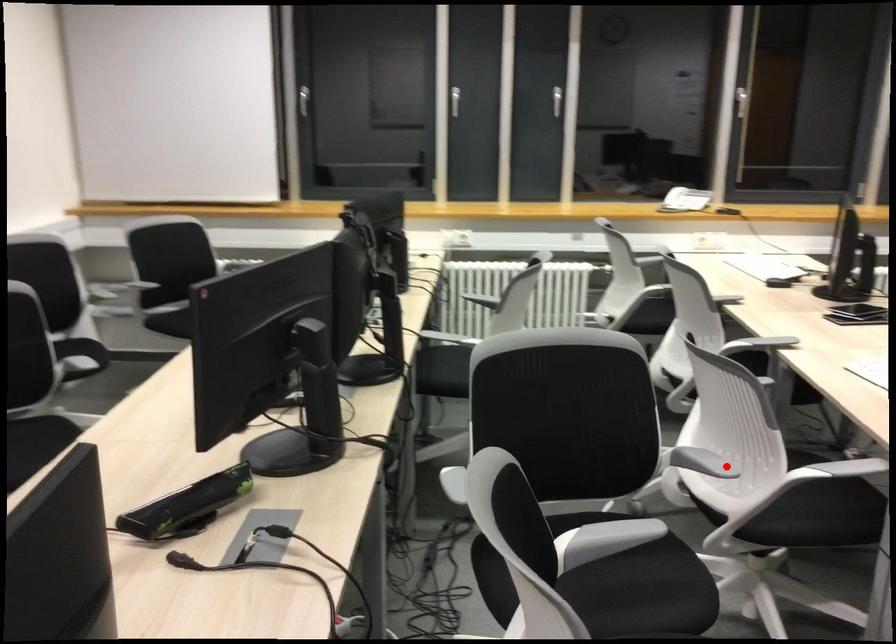
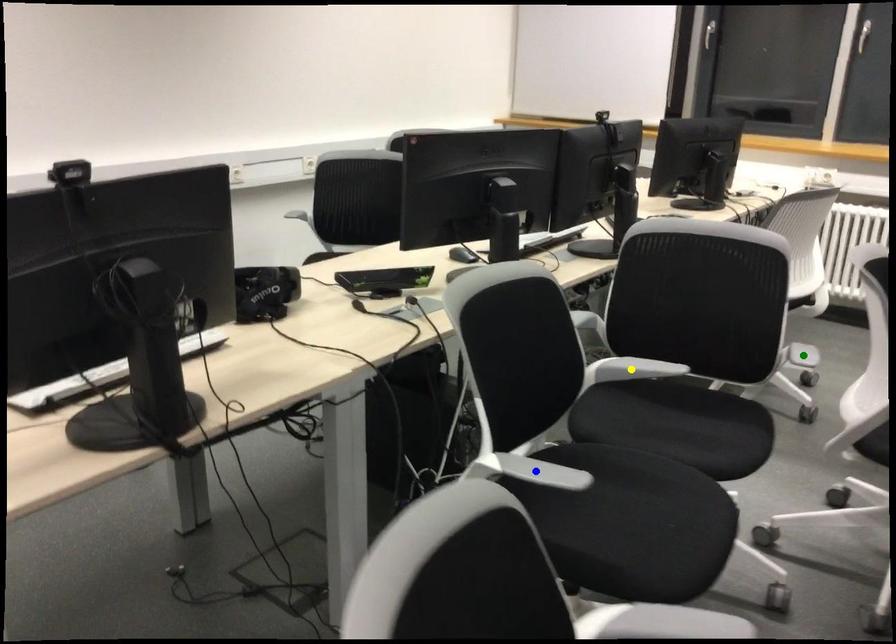
Question: I am providing you with two images of the same scene from different viewpoints. A red point is marked on the first image. You are given multiple points on the second image. Which point in image 2 represents the same 3d spot as the red point in image 1?

Choices:
 (A) blue point
 (B) green point
 (C) yellow point

Answer: (B)